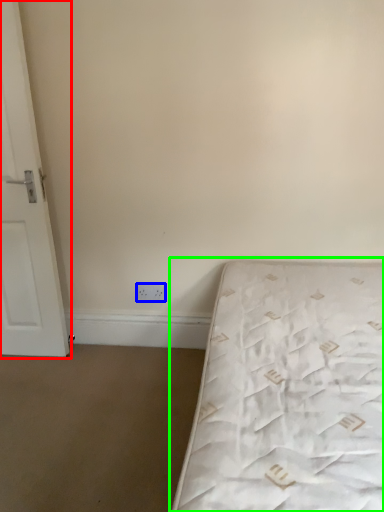
Question: Which object is positioned closest to door (highlighted by a red box)? Select from electric outlet (highlighted by a blue box) and bed (highlighted by a green box).

Choices:
 (A) electric outlet
 (B) bed

Answer: (A)